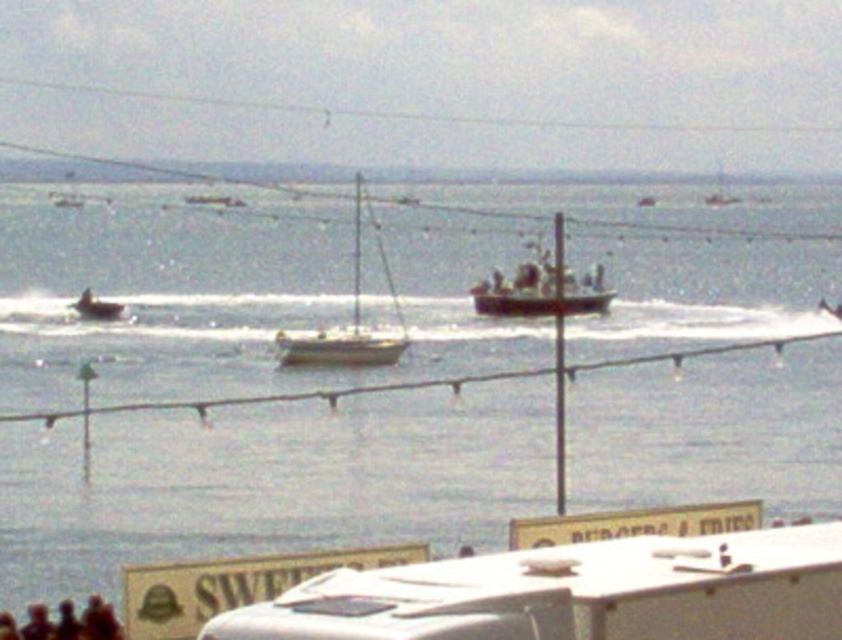
Can you confirm if white matte sailboat at center is positioned above smooth white boat at left?

Indeed, white matte sailboat at center is positioned over smooth white boat at left.

Between point (376, 340) and point (110, 317), which one is positioned behind?

The point (110, 317) is behind.

Find the location of a particular element. This screenshot has width=842, height=640. white matte sailboat at center is located at coordinates (352, 316).

Who is positioned more to the right, clear water at center or metallic red boat at center?

metallic red boat at center

Is point (97, 262) farther from camera compared to point (491, 307)?

Yes, it is.

What are the coordinates of `clear water at center` in the screenshot? It's located at (248, 390).

Is point (595, 307) closer to viewer compared to point (323, 353)?

No, (595, 307) is further to viewer.

Between point (513, 280) and point (366, 333), which one is positioned in front?

Point (366, 333)

Find the location of a particular element. This screenshot has width=842, height=640. metallic red boat at center is located at coordinates (542, 288).